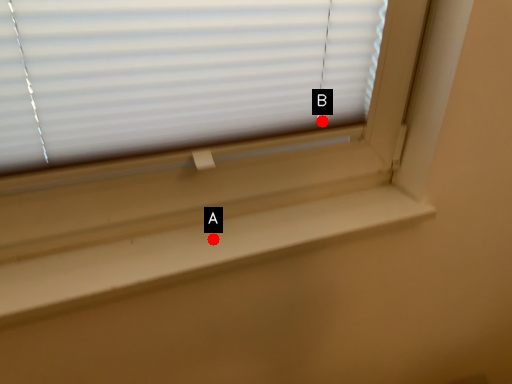
Question: Two points are circled on the image, labeled by A and B beside each circle. Which point is closer to the camera?

Choices:
 (A) A is closer
 (B) B is closer

Answer: (A)